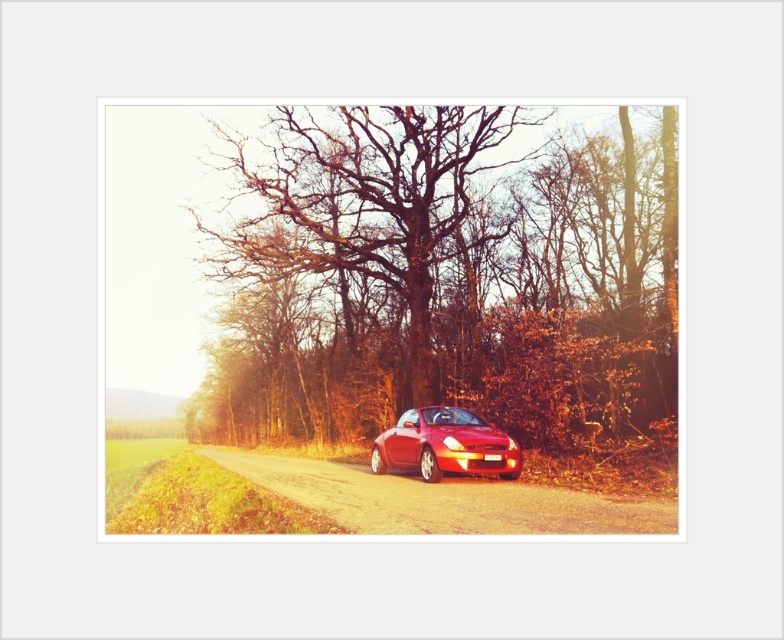
Does bare branches at center lie in front of glossy red car at center?

That is False.

Which of these two, bare branches at center or glossy red car at center, stands shorter?

glossy red car at center

Does point (216, 234) lie behind point (474, 468)?

Yes, it is behind point (474, 468).

You are a GUI agent. You are given a task and a screenshot of the screen. Output one action in this format:
    pyautogui.click(x=<x>, y=<y>)
    Task: Click on the bare branches at center
    
    Given the screenshot: What is the action you would take?
    pyautogui.click(x=441, y=276)

Does smooth asphalt road at center appear on the right side of glossy red car at center?

No, smooth asphalt road at center is not to the right of glossy red car at center.

Is smooth asphalt road at center positioned before glossy red car at center?

Yes, it is in front of glossy red car at center.

Locate an element on the screen. This screenshot has height=640, width=784. smooth asphalt road at center is located at coordinates (445, 500).

Is point (456, 212) in front of point (211, 458)?

Yes, point (456, 212) is closer to viewer.

Does point (198, 426) lie behind point (518, 522)?

Yes, point (198, 426) is farther from viewer.

I want to click on bare branches at center, so click(441, 276).